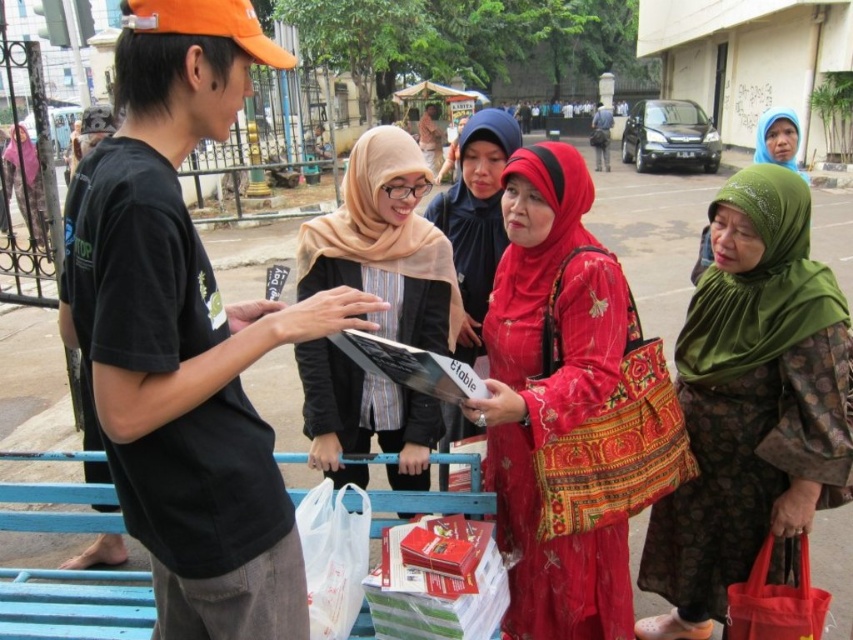
Can you confirm if matte red dress at center is smaller than matte beige scarf at center?

No, matte red dress at center is not smaller than matte beige scarf at center.

Is matte red dress at center positioned behind matte beige scarf at center?

No, it is not.

At what (x,y) coordinates should I click in order to perform the action: click on matte red dress at center. Please return your answer as a coordinate pair (x, y). This screenshot has height=640, width=853. Looking at the image, I should click on (550, 396).

Locate an element on the screen. The image size is (853, 640). matte red dress at center is located at coordinates (550, 396).

Is green printed dress at right smaller than matte red dress at center?

Yes, green printed dress at right is smaller than matte red dress at center.

Between green printed dress at right and matte red dress at center, which one has less height?

matte red dress at center is shorter.

Where is `green printed dress at right`? green printed dress at right is located at coordinates (752, 406).

Which of these two, green printed dress at right or matte beige scarf at center, stands shorter?

Standing shorter between the two is matte beige scarf at center.

Is green printed dress at right behind matte beige scarf at center?

Yes, green printed dress at right is further from the viewer.

Where is `green printed dress at right`? The width and height of the screenshot is (853, 640). green printed dress at right is located at coordinates (752, 406).

Where is `green printed dress at right`? The image size is (853, 640). green printed dress at right is located at coordinates pos(752,406).